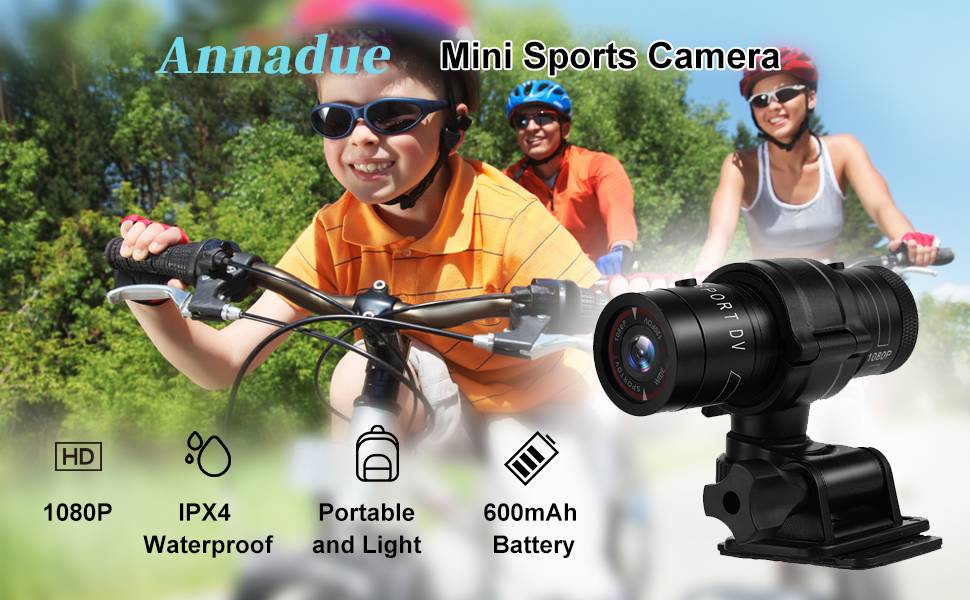
Where is `light`? The width and height of the screenshot is (970, 600). light is located at coordinates (417, 518).